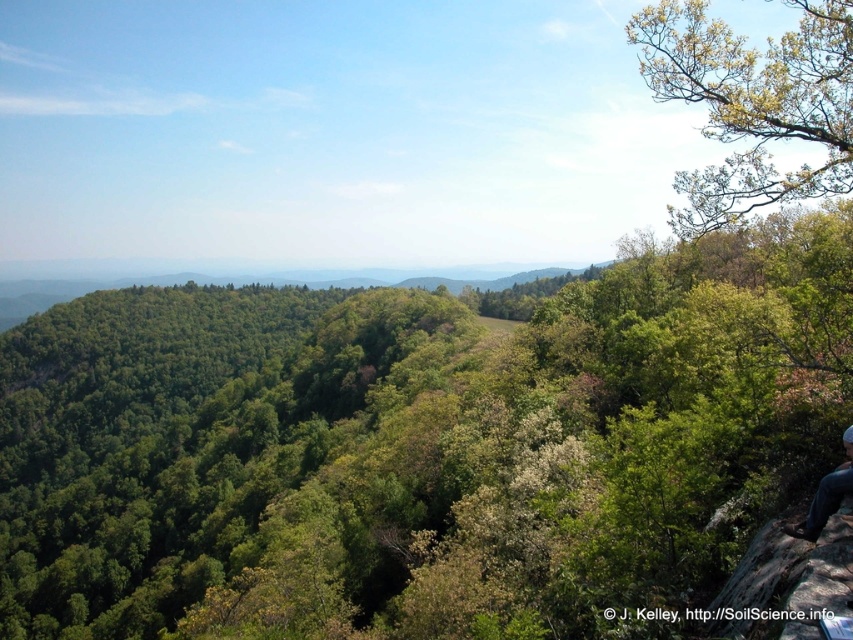
Question: Is green leafy tree at upper center thinner than blue jeans at lower right?

Choices:
 (A) yes
 (B) no

Answer: (B)

Question: Does green leafy tree at upper center appear on the left side of blue jeans at lower right?

Choices:
 (A) yes
 (B) no

Answer: (A)

Question: Which object is positioned farthest from the green leafy tree at upper center?

Choices:
 (A) blue jeans at lower right
 (B) green leafy tree at upper right

Answer: (B)

Question: Which point is farther to the camera?

Choices:
 (A) (792, 529)
 (B) (641, 58)

Answer: (B)

Question: Is the position of green leafy tree at upper right more distant than that of blue jeans at lower right?

Choices:
 (A) yes
 (B) no

Answer: (A)

Question: Which object is positioned closest to the blue jeans at lower right?

Choices:
 (A) green leafy tree at upper center
 (B) green leafy tree at upper right

Answer: (B)